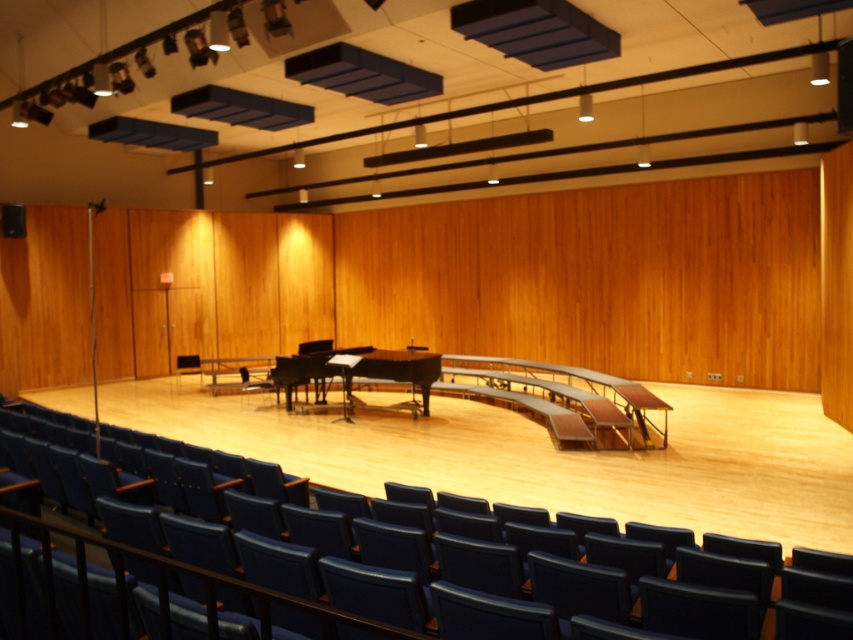
You are a stagehand preparing to set up a microphone stand between the blue leather chair at center and the dark blue fabric chair at center. Which chair should you place the stand closer to if you want the microphone to be at a comfortable height for a 6 foot tall performer?

The blue leather chair at center has a greater height compared to the dark blue fabric chair at center. To ensure the microphone stand is at a comfortable height for a 6 foot tall performer, place it closer to the blue leather chair at center so the performer can reach it easily while seated.

You are an audience member sitting in the dark blue fabric chair at center. You want to move to the shiny black piano at center. Which direction should you move to reach it?

The shiny black piano at center is to the right of the dark blue fabric chair at center, so you should move to the right to reach it.